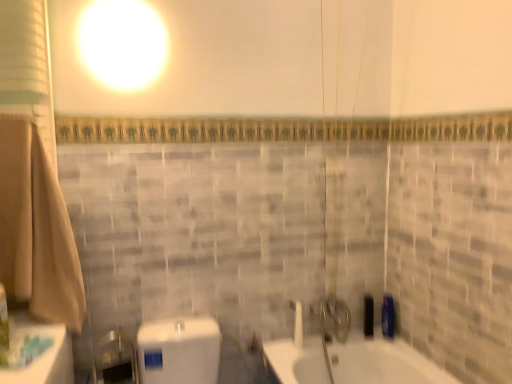
Describe the element at coordinates (297, 323) in the screenshot. I see `white glossy shower at center` at that location.

The image size is (512, 384). I want to click on blue glossy bottle at right, placed as the first toiletry when sorted from right to left, so click(x=388, y=316).

Locate an element on the screen. The height and width of the screenshot is (384, 512). green plastic toothbrush at lower left, the first toiletry in the left-to-right sequence is located at coordinates (4, 328).

The height and width of the screenshot is (384, 512). I want to click on white glossy shower at center, so click(297, 323).

Is white glossy shower at center inside beige cotton bath towel at left?

No, white glossy shower at center is located outside of beige cotton bath towel at left.

From the image's perspective, is beige cotton bath towel at left above or below white glossy shower at center?

beige cotton bath towel at left is situated higher than white glossy shower at center in the image.

Would you consider beige cotton bath towel at left to be distant from white glossy shower at center?

Absolutely, beige cotton bath towel at left is distant from white glossy shower at center.

Is point (73, 245) closer to viewer compared to point (302, 320)?

Yes.

Is white glossy shower at center aimed at blue glossy bottle at right, placed as the first toiletry when sorted from right to left?

No, white glossy shower at center is not oriented towards blue glossy bottle at right, placed as the first toiletry when sorted from right to left.

Based on their sizes in the image, would you say white glossy shower at center is bigger or smaller than blue glossy bottle at right, placed as the first toiletry when sorted from right to left?

Considering their sizes, white glossy shower at center takes up more space than blue glossy bottle at right, placed as the first toiletry when sorted from right to left.

Based on the photo, are white glossy shower at center and blue glossy bottle at right, placed as the first toiletry when sorted from right to left, making contact?

No, white glossy shower at center is not beside blue glossy bottle at right, placed as the first toiletry when sorted from right to left.

Is point (302, 325) closer to camera compared to point (382, 317)?

That is True.

Consider the image. Does beige cotton bath towel at left have a larger size compared to green plastic toothbrush at lower left, the 1th toiletry from the front?

Correct, beige cotton bath towel at left is larger in size than green plastic toothbrush at lower left, the 1th toiletry from the front.

Is beige cotton bath towel at left outside of green plastic toothbrush at lower left, the first toiletry in the left-to-right sequence?

beige cotton bath towel at left lies outside green plastic toothbrush at lower left, the first toiletry in the left-to-right sequence,'s area.

Does beige cotton bath towel at left turn towards green plastic toothbrush at lower left, the third toiletry from the right?

Yes, beige cotton bath towel at left is oriented towards green plastic toothbrush at lower left, the third toiletry from the right.

From a real-world perspective, which object stands above the other?

green plastic toothbrush at lower left, the first toiletry in the left-to-right sequence, is physically above.

Is blue glossy bottle at right, acting as the second toiletry starting from the back, facing away from green plastic toothbrush at lower left, the first toiletry in the left-to-right sequence?

No, green plastic toothbrush at lower left, the first toiletry in the left-to-right sequence, is not at the back of blue glossy bottle at right, acting as the second toiletry starting from the back.

Between blue glossy bottle at right, acting as the second toiletry starting from the back, and green plastic toothbrush at lower left, the 1th toiletry from the front, which one has larger width?

blue glossy bottle at right, acting as the second toiletry starting from the back.

Considering the sizes of blue glossy bottle at right, acting as the second toiletry starting from the back, and white glossy shower at center in the image, is blue glossy bottle at right, acting as the second toiletry starting from the back, taller or shorter than white glossy shower at center?

blue glossy bottle at right, acting as the second toiletry starting from the back, is taller than white glossy shower at center.

Considering the sizes of objects blue glossy bottle at right, the third toiletry positioned from the left, and white glossy shower at center in the image provided, who is smaller, blue glossy bottle at right, the third toiletry positioned from the left, or white glossy shower at center?

With smaller size is blue glossy bottle at right, the third toiletry positioned from the left.

Is point (387, 298) positioned behind point (298, 308)?

Yes, point (387, 298) is farther from viewer.

Considering the sizes of blue glossy bottle at right, placed as the first toiletry when sorted from right to left, and white glossy shower at center in the image, is blue glossy bottle at right, placed as the first toiletry when sorted from right to left, wider or thinner than white glossy shower at center?

blue glossy bottle at right, placed as the first toiletry when sorted from right to left, is thinner than white glossy shower at center.

Choose the correct answer: Is green plastic toothbrush at lower left, the 1th toiletry from the front, inside black matte soap dispenser at right, the second toiletry positioned from the left, or outside it?

green plastic toothbrush at lower left, the 1th toiletry from the front, cannot be found inside black matte soap dispenser at right, the second toiletry positioned from the left.

Based on the photo, from a real-world perspective, is green plastic toothbrush at lower left, marked as the 3th toiletry in a back-to-front arrangement, below black matte soap dispenser at right, the second toiletry when ordered from right to left?

No, from a real-world perspective, green plastic toothbrush at lower left, marked as the 3th toiletry in a back-to-front arrangement, is not beneath black matte soap dispenser at right, the second toiletry when ordered from right to left.

From the image's perspective, which object appears higher, green plastic toothbrush at lower left, marked as the 3th toiletry in a back-to-front arrangement, or black matte soap dispenser at right, the second toiletry when ordered from right to left?

green plastic toothbrush at lower left, marked as the 3th toiletry in a back-to-front arrangement, from the image's perspective.

Considering the sizes of objects green plastic toothbrush at lower left, the third toiletry from the right, and black matte soap dispenser at right, the second toiletry when ordered from right to left, in the image provided, who is taller, green plastic toothbrush at lower left, the third toiletry from the right, or black matte soap dispenser at right, the second toiletry when ordered from right to left,?

With more height is green plastic toothbrush at lower left, the third toiletry from the right.

Which of these two, black matte soap dispenser at right, the second toiletry when ordered from right to left, or green plastic toothbrush at lower left, marked as the 3th toiletry in a back-to-front arrangement, is bigger?

With larger size is green plastic toothbrush at lower left, marked as the 3th toiletry in a back-to-front arrangement.

Considering the points (367, 308) and (2, 291), which point is behind, point (367, 308) or point (2, 291)?

Point (367, 308)

From a real-world perspective, which is physically below, black matte soap dispenser at right, the second toiletry when ordered from right to left, or green plastic toothbrush at lower left, the third toiletry from the right?

In real-world perspective, black matte soap dispenser at right, the second toiletry when ordered from right to left, is lower.

From the image's perspective, is black matte soap dispenser at right, the second toiletry when ordered from right to left, on top of green plastic toothbrush at lower left, the third toiletry from the right?

Actually, black matte soap dispenser at right, the second toiletry when ordered from right to left, appears below green plastic toothbrush at lower left, the third toiletry from the right, in the image.

Where is `bath towel above the white glossy shower at center (from a real-world perspective)`? The width and height of the screenshot is (512, 384). bath towel above the white glossy shower at center (from a real-world perspective) is located at coordinates (36, 229).

The height and width of the screenshot is (384, 512). Identify the location of shower below the blue glossy bottle at right, placed as the first toiletry when sorted from right to left (from the image's perspective). (297, 323).

Estimate the real-world distances between objects in this image. Which object is closer to green plastic toothbrush at lower left, the first toiletry in the left-to-right sequence, white glossy shower at center or beige cotton bath towel at left?

beige cotton bath towel at left lies closer to green plastic toothbrush at lower left, the first toiletry in the left-to-right sequence, than the other object.

Estimate the real-world distances between objects in this image. Which object is closer to beige cotton bath towel at left, black matte soap dispenser at right, the second toiletry positioned from the left, or white glossy shower at center?

white glossy shower at center.

Looking at the image, which one is located closer to black matte soap dispenser at right, the third toiletry from the front, blue glossy bottle at right, which is counted as the 2th toiletry, starting from the front, or green plastic toothbrush at lower left, the first toiletry in the left-to-right sequence?

blue glossy bottle at right, which is counted as the 2th toiletry, starting from the front, is positioned closer to the anchor black matte soap dispenser at right, the third toiletry from the front.

Which object lies nearer to the anchor point black matte soap dispenser at right, the second toiletry when ordered from right to left, blue glossy bottle at right, acting as the second toiletry starting from the back, or beige cotton bath towel at left?

Among the two, blue glossy bottle at right, acting as the second toiletry starting from the back, is located nearer to black matte soap dispenser at right, the second toiletry when ordered from right to left.

From the image, which object appears to be nearer to beige cotton bath towel at left, black matte soap dispenser at right, the second toiletry positioned from the left, or blue glossy bottle at right, acting as the second toiletry starting from the back?

black matte soap dispenser at right, the second toiletry positioned from the left, is positioned closer to the anchor beige cotton bath towel at left.

Which object lies nearer to the anchor point black matte soap dispenser at right, the second toiletry when ordered from right to left, white glossy shower at center or green plastic toothbrush at lower left, marked as the 3th toiletry in a back-to-front arrangement?

white glossy shower at center is positioned closer to the anchor black matte soap dispenser at right, the second toiletry when ordered from right to left.

From the image, which object appears to be nearer to green plastic toothbrush at lower left, the 1th toiletry from the front, black matte soap dispenser at right, the second toiletry positioned from the left, or white glossy shower at center?

white glossy shower at center is positioned closer to the anchor green plastic toothbrush at lower left, the 1th toiletry from the front.

Consider the image. From the image, which object appears to be nearer to black matte soap dispenser at right, the second toiletry when ordered from right to left, blue glossy bottle at right, the third toiletry positioned from the left, or white glossy shower at center?

Among the two, blue glossy bottle at right, the third toiletry positioned from the left, is located nearer to black matte soap dispenser at right, the second toiletry when ordered from right to left.

Locate an element on the screen. bath towel located between green plastic toothbrush at lower left, the third toiletry from the right, and black matte soap dispenser at right, the second toiletry when ordered from right to left, in the left-right direction is located at coordinates (36, 229).

Locate an element on the screen. The width and height of the screenshot is (512, 384). shower between green plastic toothbrush at lower left, the third toiletry from the right, and blue glossy bottle at right, which is counted as the 2th toiletry, starting from the front is located at coordinates (297, 323).

Where is `bath towel between green plastic toothbrush at lower left, the first toiletry in the left-to-right sequence, and blue glossy bottle at right, placed as the first toiletry when sorted from right to left, from left to right`? bath towel between green plastic toothbrush at lower left, the first toiletry in the left-to-right sequence, and blue glossy bottle at right, placed as the first toiletry when sorted from right to left, from left to right is located at coordinates (36, 229).

Identify the location of shower between beige cotton bath towel at left and black matte soap dispenser at right, placed as the first toiletry when sorted from back to front. The width and height of the screenshot is (512, 384). [297, 323].